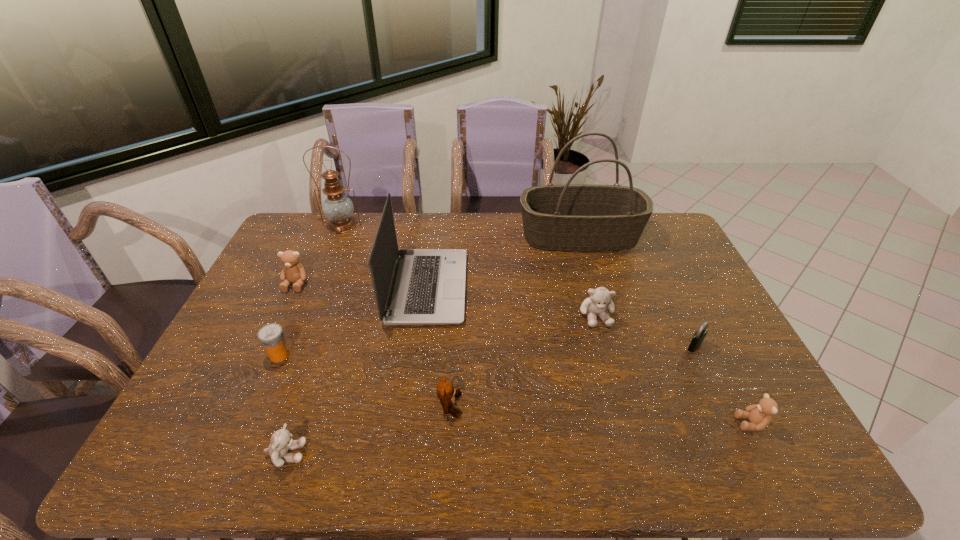
The width and height of the screenshot is (960, 540). I want to click on basket, so click(574, 217).

At what (x,y) coordinates should I click in order to perform the action: click on oil lamp. Please return your answer as a coordinate pair (x, y). The width and height of the screenshot is (960, 540). Looking at the image, I should click on (338, 208).

Identify the location of laptop computer. (428, 285).

Identify the location of the leftmost teddy bear. 292,272.

The image size is (960, 540). I want to click on the farthest brown teddy bear, so click(292, 272).

The height and width of the screenshot is (540, 960). In order to click on the bigger gray teddy bear in this screenshot , I will do `click(599, 301)`.

Where is `the farther gray teddy bear`? This screenshot has height=540, width=960. the farther gray teddy bear is located at coordinates (599, 301).

This screenshot has height=540, width=960. In order to click on padlock in this screenshot , I will do `click(699, 336)`.

At what (x,y) coordinates should I click in order to perform the action: click on the third teddy bear from left to right. Please return your answer as a coordinate pair (x, y). Looking at the image, I should click on (446, 393).

You are a GUI agent. You are given a task and a screenshot of the screen. Output one action in this format:
    pyautogui.click(x=<x>, y=<y>)
    Task: Click on the orange medicine
    
    Given the screenshot: What is the action you would take?
    pos(271,336)